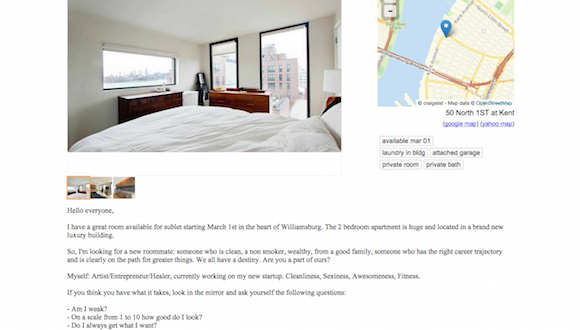
Find the location of a particular element. window is located at coordinates (71, 189), (79, 185), (86, 190), (99, 187), (104, 189), (126, 71), (220, 65), (278, 87).